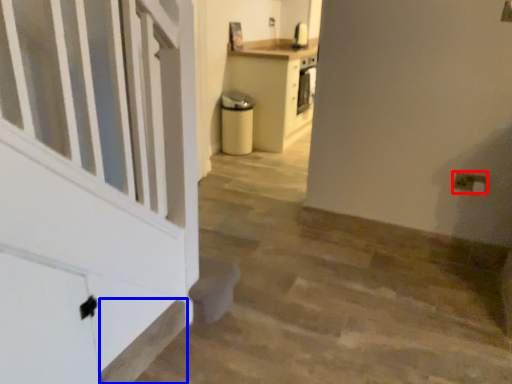
Question: Which object appears closest to the camera in this image, electric outlet (highlighted by a red box) or stairwell (highlighted by a blue box)?

Choices:
 (A) electric outlet
 (B) stairwell

Answer: (B)